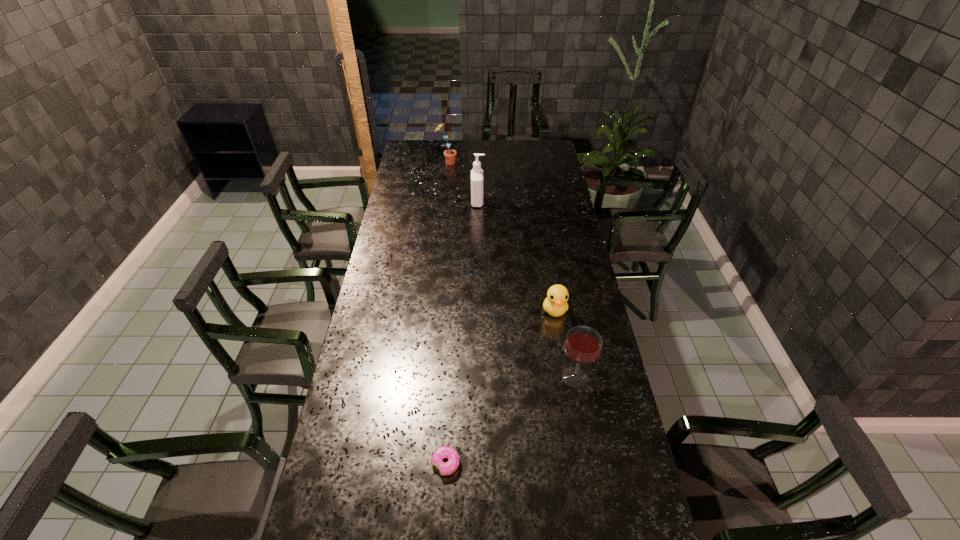
Image resolution: width=960 pixels, height=540 pixels. Identify the location of vacant region at the far right corner. (538, 143).

This screenshot has height=540, width=960. I want to click on free space between the fourth farthest object and the sunflower, so click(x=511, y=270).

I want to click on vacant space in between the sunflower and the shortest object, so click(446, 313).

You are a GUI agent. You are given a task and a screenshot of the screen. Output one action in this format:
    pyautogui.click(x=<x>, y=<y>)
    Task: Click on the vacant space in between the second nearest object and the third object from left to right
    
    Given the screenshot: What is the action you would take?
    pyautogui.click(x=526, y=289)

Image resolution: width=960 pixels, height=540 pixels. I want to click on vacant area that lies between the shortest object and the second shortest object, so tap(500, 387).

Identify the location of vacant point located between the duck and the fourth nearest object. (516, 256).

Locate an element on the screen. The image size is (960, 540). free spot between the third nearest object and the third object from left to right is located at coordinates (516, 256).

At what (x,y) coordinates should I click in order to perform the action: click on free space between the shortest object and the cleansing agent. Please return your answer as a coordinate pair (x, y). The height and width of the screenshot is (540, 960). Looking at the image, I should click on (462, 333).

This screenshot has height=540, width=960. In order to click on free spot between the farthest object and the doughnut in this screenshot , I will do pyautogui.click(x=446, y=313).

Point out which object is positioned as the fourth nearest to the wineglass. Please provide its 2D coordinates. Your answer should be formatted as a tuple, i.e. [(x, y)], where the tuple contains the x and y coordinates of a point satisfying the conditions above.

[(450, 155)]